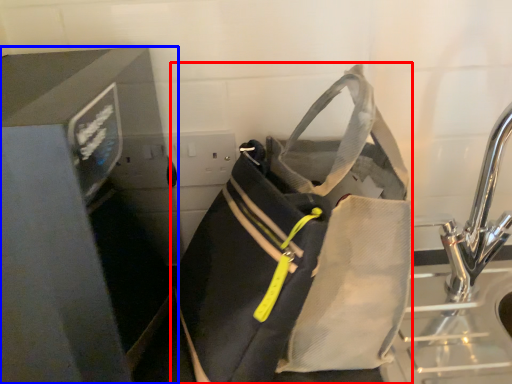
Question: Among these objects, which one is nearest to the camera, luggage and bags (highlighted by a red box) or appliance (highlighted by a blue box)?

Choices:
 (A) luggage and bags
 (B) appliance

Answer: (B)